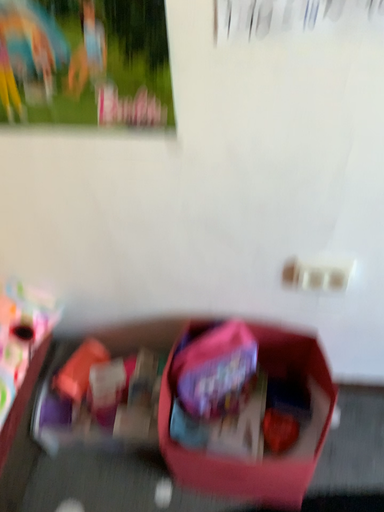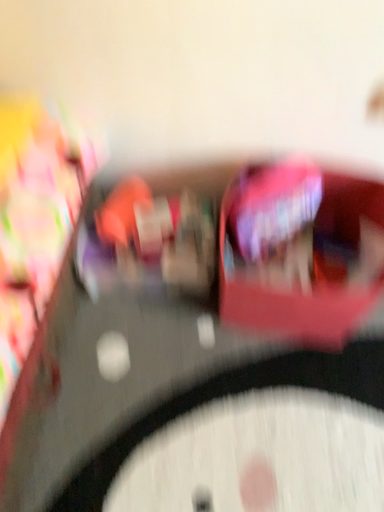
Question: Which way did the camera rotate in the video?

Choices:
 (A) rotated downward
 (B) rotated upward

Answer: (A)